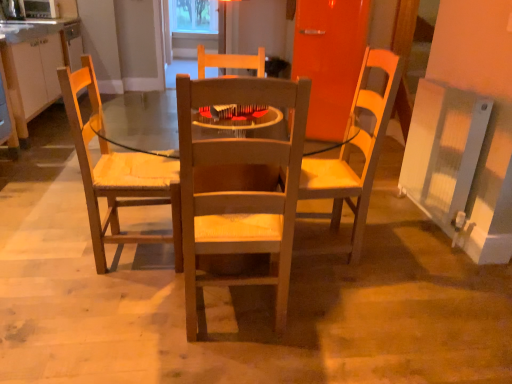
What do you see at coordinates (37, 64) in the screenshot? I see `matte white cabinets at left` at bounding box center [37, 64].

Measure the distance between point (212, 14) and camera.

The distance of point (212, 14) from camera is 16.89 feet.

The image size is (512, 384). Describe the element at coordinates (117, 172) in the screenshot. I see `wooden chair at left` at that location.

Identify the location of wooden chair at left. The image size is (512, 384). (117, 172).

The height and width of the screenshot is (384, 512). What are the coordinates of `matte white cabinets at left` in the screenshot? It's located at (x=37, y=64).

Looking at this image, can you see matte white cabinets at left touching wooden chair at center?

No, matte white cabinets at left is not touching wooden chair at center.

Is wooden chair at center inside matte white cabinets at left?

No, matte white cabinets at left does not contain wooden chair at center.

Does point (79, 21) come closer to viewer compared to point (154, 192)?

That is False.

Is transparent plastic window screen at upper center looking in the opposite direction of matte white cabinets at left?

No, transparent plastic window screen at upper center is not facing the opposite direction of matte white cabinets at left.

I want to click on cabinetry that is on the left side of transparent plastic window screen at upper center, so click(x=37, y=64).

Who is smaller, transparent plastic window screen at upper center or matte white cabinets at left?

transparent plastic window screen at upper center is smaller.

Is point (214, 6) farther from camera compared to point (20, 121)?

Yes.

Does point (261, 200) appear closer or farther from the camera than point (50, 99)?

Point (261, 200) is closer to the camera than point (50, 99).

Consider the image. Is wooden chair at center next to matte white cabinets at left and touching it?

No.

From the image's perspective, is wooden chair at center above matte white cabinets at left?

Incorrect, from the image's perspective, wooden chair at center is lower than matte white cabinets at left.

In the image, there is a matte white cabinets at left. What are the coordinates of `trio below it (from the image's perspective)` in the screenshot? It's located at (197, 181).

Is wooden chair at center turned away from transparent plastic window screen at upper center?

Yes, wooden chair at center is positioned with its back facing transparent plastic window screen at upper center.

Which of these two, wooden chair at center or transparent plastic window screen at upper center, is bigger?

Bigger between the two is wooden chair at center.

This screenshot has height=384, width=512. In order to click on window screen above the wooden chair at center (from the image's perspective) in this screenshot , I will do `click(193, 16)`.

Considering the sizes of wooden chair at center and transparent plastic window screen at upper center in the image, is wooden chair at center taller or shorter than transparent plastic window screen at upper center?

wooden chair at center is taller than transparent plastic window screen at upper center.

From the image's perspective, does wooden chair at left appear higher than wooden chair at center?

Yes, from the image's perspective, wooden chair at left is over wooden chair at center.

In the scene shown: Considering the relative sizes of wooden chair at left and wooden chair at center in the image provided, is wooden chair at left shorter than wooden chair at center?

Incorrect, the height of wooden chair at left does not fall short of that of wooden chair at center.

Between wooden chair at left and wooden chair at center, which one has larger size?

Bigger between the two is wooden chair at center.

Is wooden chair at left positioned behind wooden chair at center?

Yes, wooden chair at left is further from the viewer.

Is transparent plastic window screen at upper center aimed at wooden chair at left?

Yes, transparent plastic window screen at upper center faces towards wooden chair at left.

Considering the relative positions of transparent plastic window screen at upper center and wooden chair at left in the image provided, is transparent plastic window screen at upper center behind wooden chair at left?

Yes, it is behind wooden chair at left.

Is transparent plastic window screen at upper center positioned beyond the bounds of wooden chair at left?

transparent plastic window screen at upper center is positioned outside wooden chair at left.

Who is bigger, transparent plastic window screen at upper center or wooden chair at center?

With larger size is wooden chair at center.

Is transparent plastic window screen at upper center facing away from wooden chair at center?

No, transparent plastic window screen at upper center is not facing away from wooden chair at center.

Does transparent plastic window screen at upper center appear on the right side of wooden chair at center?

In fact, transparent plastic window screen at upper center is to the left of wooden chair at center.

From a real-world perspective, which object stands above the other?

transparent plastic window screen at upper center is physically above.

The width and height of the screenshot is (512, 384). I want to click on cabinetry on the left of wooden chair at center, so click(37, 64).

You are a GUI agent. You are given a task and a screenshot of the screen. Output one action in this format:
    pyautogui.click(x=<x>, y=<y>)
    Task: Click on the window screen located above the matte white cabinets at left (from the image's perspective)
    Image resolution: width=512 pixels, height=384 pixels.
    Given the screenshot: What is the action you would take?
    pyautogui.click(x=193, y=16)

Which object lies further to the anchor point matte white cabinets at left, metallic silver microwave oven at upper left or wooden chair at center?

wooden chair at center is further to matte white cabinets at left.

Based on their spatial positions, is metallic silver microwave oven at upper left or wooden chair at center closer to wooden chair at left?

wooden chair at center is closer to wooden chair at left.

When comparing their distances from wooden chair at left, does transparent plastic window screen at upper center or matte white cabinets at left seem closer?

matte white cabinets at left is positioned closer to the anchor wooden chair at left.

Which object lies further to the anchor point wooden chair at center, metallic silver microwave oven at upper left or transparent plastic window screen at upper center?

Among the two, transparent plastic window screen at upper center is located further to wooden chair at center.

Estimate the real-world distances between objects in this image. Which object is closer to matte white cabinets at left, metallic silver microwave oven at upper left or transparent plastic window screen at upper center?

metallic silver microwave oven at upper left is positioned closer to the anchor matte white cabinets at left.

Estimate the real-world distances between objects in this image. Which object is closer to transparent plastic window screen at upper center, metallic silver microwave oven at upper left or wooden chair at center?

Among the two, metallic silver microwave oven at upper left is located nearer to transparent plastic window screen at upper center.

Which object lies nearer to the anchor point metallic silver microwave oven at upper left, wooden chair at left or transparent plastic window screen at upper center?

The object closer to metallic silver microwave oven at upper left is transparent plastic window screen at upper center.

Looking at the image, which one is located closer to wooden chair at left, wooden chair at center or matte white cabinets at left?

wooden chair at center is positioned closer to the anchor wooden chair at left.

Where is `chair located between wooden chair at center and metallic silver microwave oven at upper left in the depth direction`? This screenshot has height=384, width=512. chair located between wooden chair at center and metallic silver microwave oven at upper left in the depth direction is located at coordinates (117, 172).

Where is `cabinetry positioned between wooden chair at left and metallic silver microwave oven at upper left from near to far`? This screenshot has height=384, width=512. cabinetry positioned between wooden chair at left and metallic silver microwave oven at upper left from near to far is located at coordinates coord(37,64).

Where is `chair positioned between wooden chair at center and transparent plastic window screen at upper center from near to far`? chair positioned between wooden chair at center and transparent plastic window screen at upper center from near to far is located at coordinates (117, 172).

Where is `chair between matte white cabinets at left and wooden chair at center`? The width and height of the screenshot is (512, 384). chair between matte white cabinets at left and wooden chair at center is located at coordinates (117, 172).